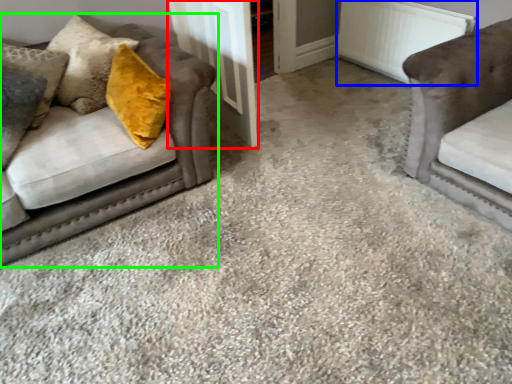
Question: Considering the real-world distances, which object is farthest from door (highlighted by a red box)? radiator (highlighted by a blue box) or studio couch (highlighted by a green box)?

Choices:
 (A) radiator
 (B) studio couch

Answer: (A)